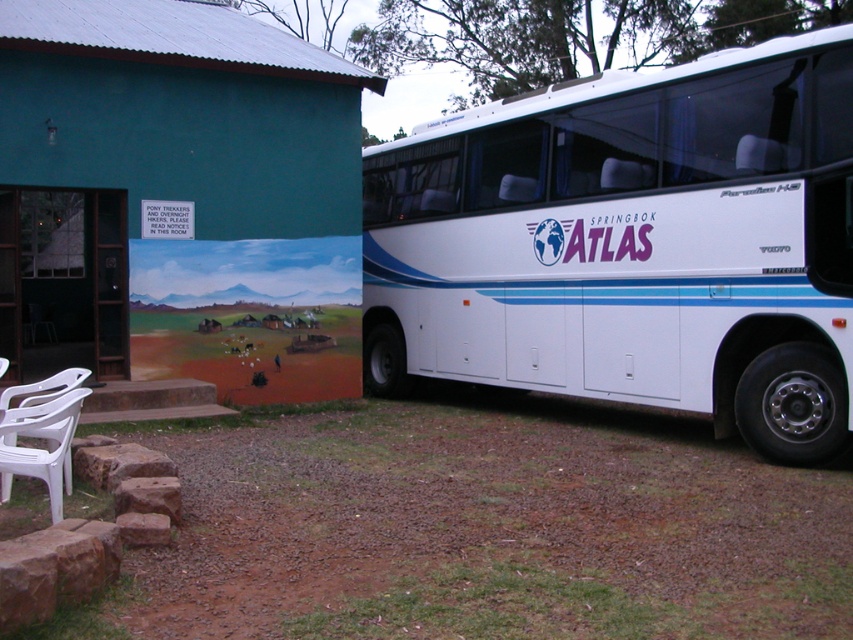
Does point (263, 22) lie in front of point (62, 417)?

No.

Image resolution: width=853 pixels, height=640 pixels. Identify the location of teal painted wall at upper left. (178, 198).

Can you confirm if white glossy/decorative bus at right is smaller than white plastic chair at lower left?

No, white glossy/decorative bus at right is not smaller than white plastic chair at lower left.

Image resolution: width=853 pixels, height=640 pixels. What are the coordinates of `white glossy/decorative bus at right` in the screenshot? It's located at (631, 243).

The width and height of the screenshot is (853, 640). What do you see at coordinates (631, 243) in the screenshot? I see `white glossy/decorative bus at right` at bounding box center [631, 243].

Locate an element on the screen. The width and height of the screenshot is (853, 640). white glossy/decorative bus at right is located at coordinates (631, 243).

Which is in front, point (552, 266) or point (364, 80)?

Positioned in front is point (552, 266).

The image size is (853, 640). Find the location of `white glossy/decorative bus at right`. white glossy/decorative bus at right is located at coordinates (631, 243).